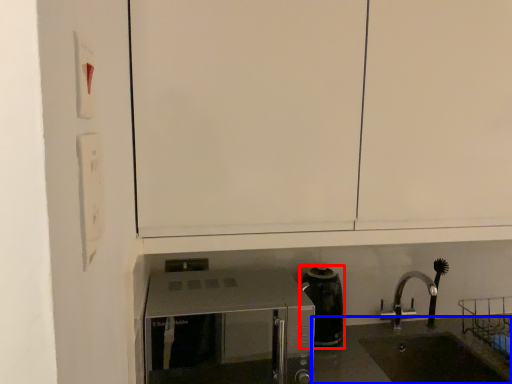
Question: Which object appears closest to the camera in this image, coffeepot (highlighted by a red box) or counter top (highlighted by a blue box)?

Choices:
 (A) coffeepot
 (B) counter top

Answer: (B)